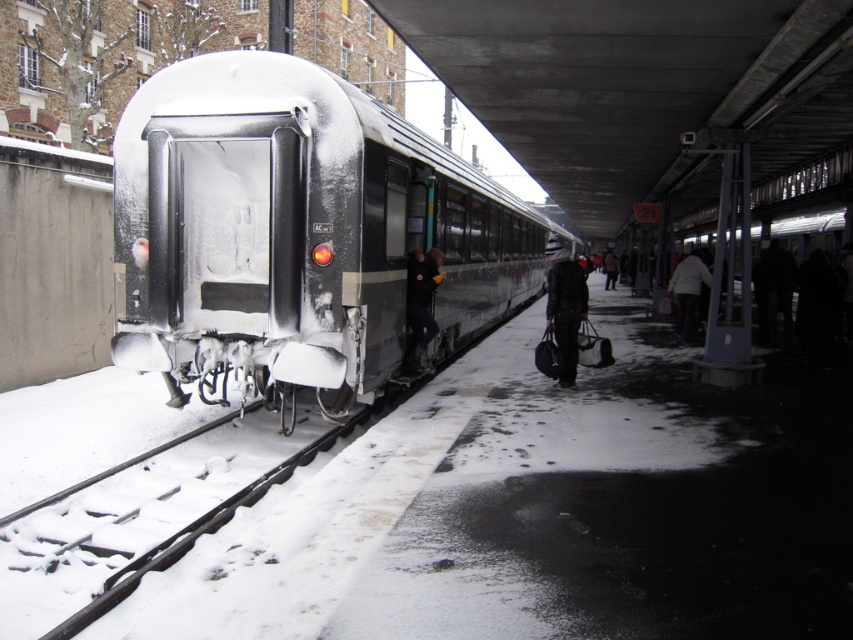
You are a traveler trying to decide which coat to wear for the snowy weather. You see a dark fabric coat at lower right and a dark brown leather jacket at center. Which one is narrower in width?

The dark fabric coat at lower right is narrower in width than the dark brown leather jacket at center.

Based on the photo, you are standing at the train station and want to take a photo of both point (753, 273) and point (613, 275) in the scene. Which point should you focus on first to ensure both are in sharp focus?

You should focus on point (753, 273) first because it is closer to the camera than point (613, 275). This ensures the closer point is in focus, and the farther point will also be within the depth of field.